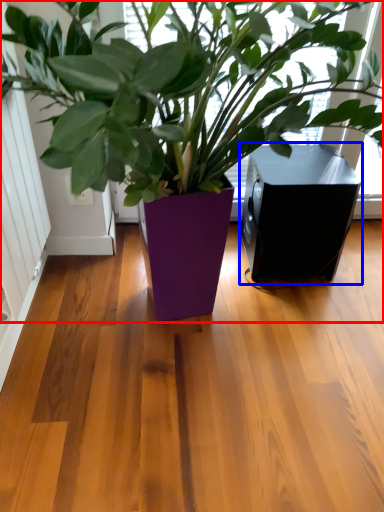
Question: Which object is further to the camera taking this photo, houseplant (highlighted by a red box) or speaker (highlighted by a blue box)?

Choices:
 (A) houseplant
 (B) speaker

Answer: (B)